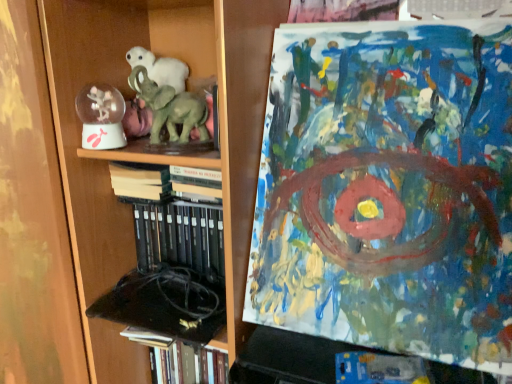
Question: Considering the relative positions of hardcover books at center, the first book positioned from the top, and green matte elephant at center in the image provided, is hardcover books at center, the first book positioned from the top, in front of green matte elephant at center?

Choices:
 (A) no
 (B) yes

Answer: (A)

Question: Is hardcover books at center, the 2th book in the bottom-to-top sequence, far from green matte elephant at center?

Choices:
 (A) yes
 (B) no

Answer: (B)

Question: From a real-world perspective, is hardcover books at center, the first book positioned from the top, on top of green matte elephant at center?

Choices:
 (A) no
 (B) yes

Answer: (A)

Question: Is green matte elephant at center surrounded by hardcover books at center, the 2th book in the bottom-to-top sequence?

Choices:
 (A) no
 (B) yes

Answer: (A)

Question: Considering the relative sizes of hardcover books at center, the 2th book in the bottom-to-top sequence, and green matte elephant at center in the image provided, is hardcover books at center, the 2th book in the bottom-to-top sequence, thinner than green matte elephant at center?

Choices:
 (A) yes
 (B) no

Answer: (B)

Question: Does hardcover books at center, the 2th book in the bottom-to-top sequence, have a larger size compared to green matte elephant at center?

Choices:
 (A) no
 (B) yes

Answer: (A)

Question: Can you confirm if hardcover book at lower left, positioned as the 2th book in top-to-bottom order, is smaller than wooden bookcase at left?

Choices:
 (A) no
 (B) yes

Answer: (B)

Question: Does hardcover book at lower left, positioned as the 2th book in top-to-bottom order, have a greater width compared to wooden bookcase at left?

Choices:
 (A) yes
 (B) no

Answer: (B)

Question: Is hardcover book at lower left, positioned as the 2th book in top-to-bottom order, outside wooden bookcase at left?

Choices:
 (A) yes
 (B) no

Answer: (B)

Question: From the image's perspective, would you say hardcover book at lower left, placed as the first book when sorted from bottom to top, is positioned over wooden bookcase at left?

Choices:
 (A) yes
 (B) no

Answer: (B)

Question: From the image's perspective, is hardcover book at lower left, positioned as the 2th book in top-to-bottom order, located beneath wooden bookcase at left?

Choices:
 (A) yes
 (B) no

Answer: (A)

Question: Is hardcover book at lower left, placed as the first book when sorted from bottom to top, taller than wooden bookcase at left?

Choices:
 (A) yes
 (B) no

Answer: (B)

Question: From a real-world perspective, does green matte elephant at center stand above hardcover book at lower left, positioned as the 2th book in top-to-bottom order?

Choices:
 (A) no
 (B) yes

Answer: (B)